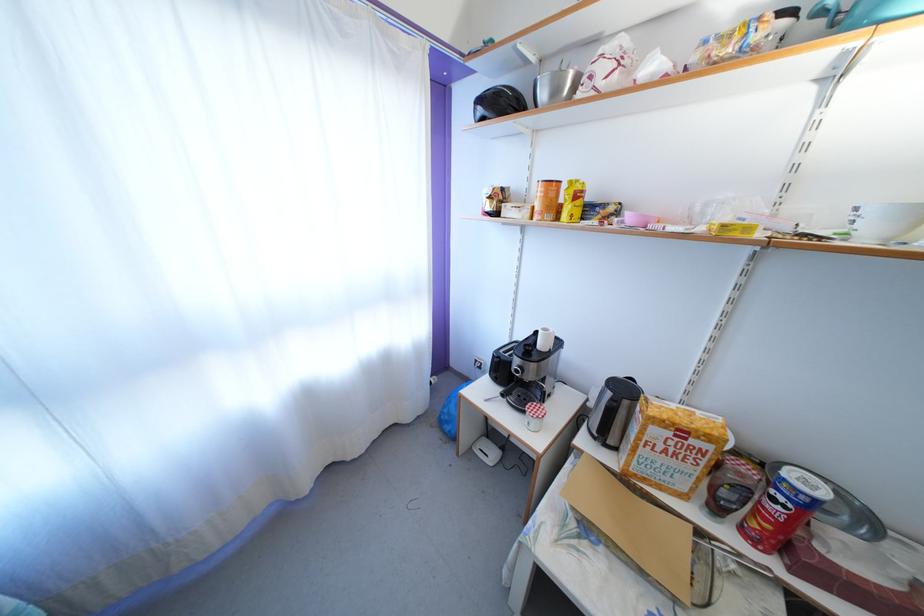
Where is `white ceramic bowl`? This screenshot has height=616, width=924. white ceramic bowl is located at coordinates (883, 221).